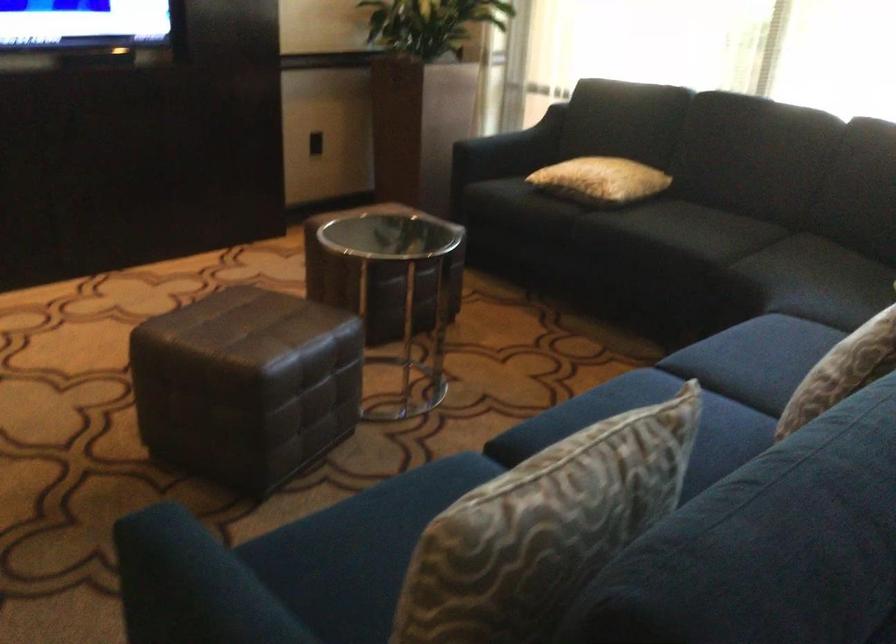
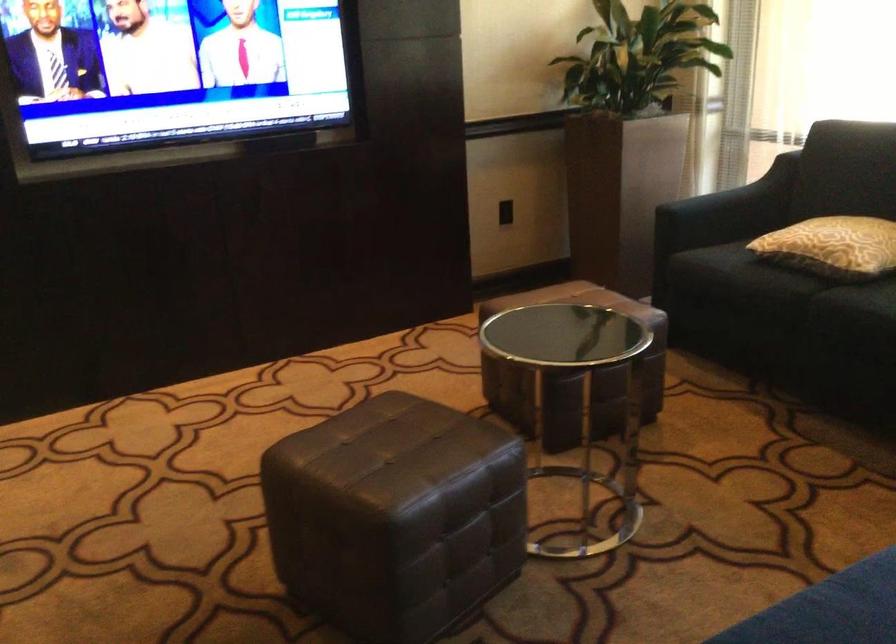
Where in the second image is the point corresponding to (271,371) from the first image?

(394, 516)